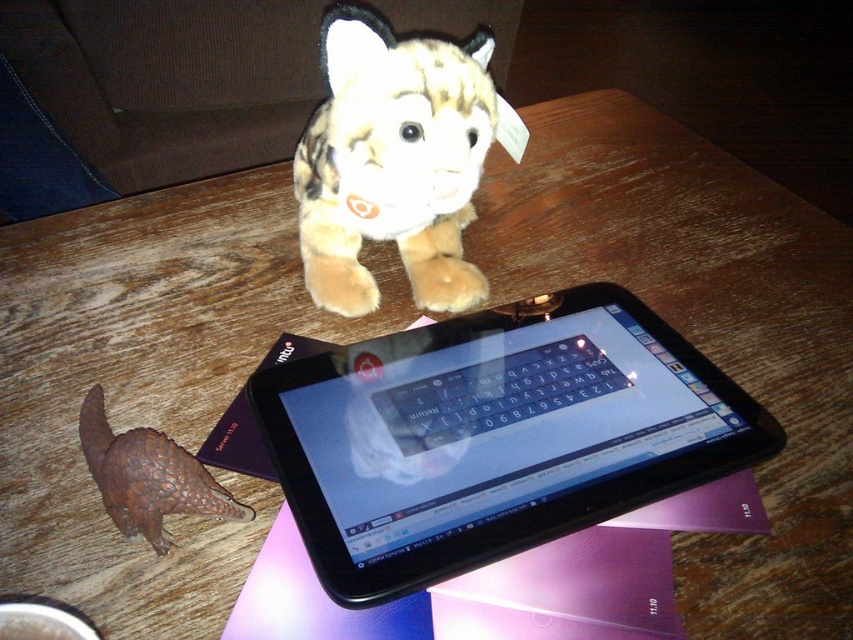
Question: Based on their relative distances, which object is nearer to the black plastic tablet at upper center?

Choices:
 (A) bumpy brown pangolin at lower left
 (B) fluffy brown plush toy at upper center

Answer: (B)

Question: Which point appears farthest from the camera in this image?

Choices:
 (A) click(x=410, y=269)
 (B) click(x=300, y=474)

Answer: (A)

Question: In this image, where is black plastic tablet at upper center located relative to bumpy brown pangolin at lower left?

Choices:
 (A) above
 (B) below

Answer: (A)

Question: Does black plastic tablet at upper center have a lesser width compared to bumpy brown pangolin at lower left?

Choices:
 (A) no
 (B) yes

Answer: (A)

Question: Does black plastic tablet at upper center have a larger size compared to bumpy brown pangolin at lower left?

Choices:
 (A) no
 (B) yes

Answer: (B)

Question: Which point appears farthest from the camera in this image?

Choices:
 (A) (372, 436)
 (B) (112, 474)
 (C) (451, 230)

Answer: (C)